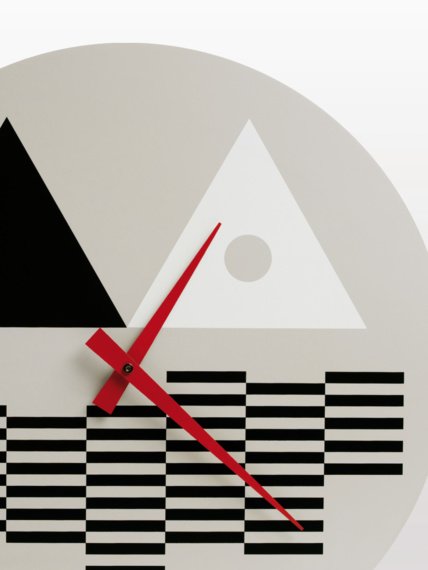
Identify the location of clock. (262, 355).